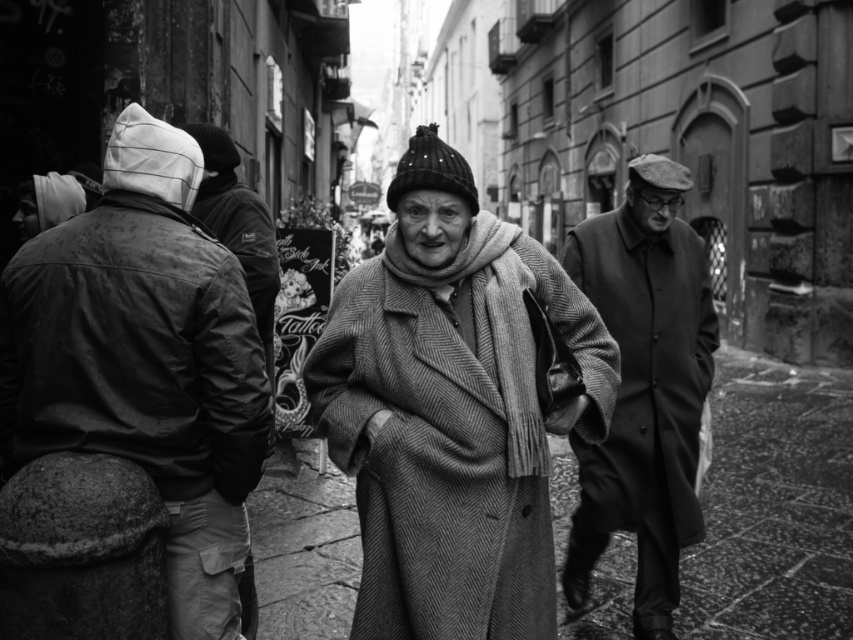
The height and width of the screenshot is (640, 853). Identify the location of herringbone wool coat at center. (451, 432).

Who is more distant from viewer, [444,300] or [689,353]?

The point [689,353] is more distant.

What do you see at coordinates (451, 432) in the screenshot? I see `herringbone wool coat at center` at bounding box center [451, 432].

At what (x,y) coordinates should I click in order to perform the action: click on herringbone wool coat at center. Please return your answer as a coordinate pair (x, y). Looking at the image, I should click on (451, 432).

Locate an element on the screen. The width and height of the screenshot is (853, 640). leather jacket at left is located at coordinates (146, 364).

Does point (187, 445) come farther from viewer compared to point (498, 324)?

No, (187, 445) is closer to viewer.

Is point (207, 636) more distant than point (413, 259)?

Yes, it is behind point (413, 259).

I want to click on leather jacket at left, so click(x=146, y=364).

Does herringbone wool coat at center have a lesser height compared to leather jacket at left?

Correct, herringbone wool coat at center is not as tall as leather jacket at left.

Does herringbone wool coat at center have a greater width compared to leather jacket at left?

Yes, herringbone wool coat at center is wider than leather jacket at left.

The image size is (853, 640). I want to click on herringbone wool coat at center, so click(x=451, y=432).